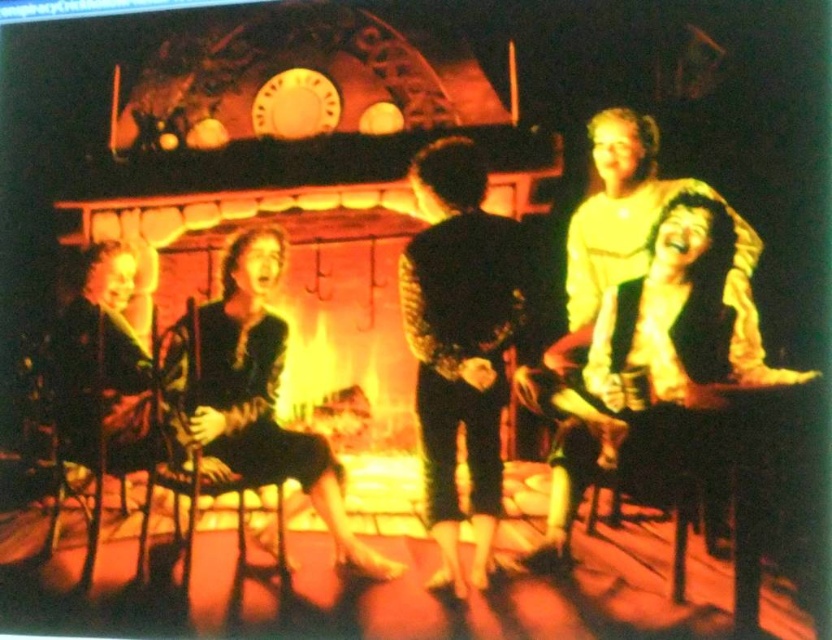
Based on the photo, does black textured jacket at center have a lesser height compared to matte black dress at center?

In fact, black textured jacket at center may be taller than matte black dress at center.

Is point (438, 141) farther from camera compared to point (176, 337)?

Yes, it is.

This screenshot has height=640, width=832. What are the coordinates of `black textured jacket at center` in the screenshot? It's located at (459, 342).

Which of these two, black textured jacket at center or wooden table at center, stands taller?

black textured jacket at center is taller.

Is black textured jacket at center positioned before wooden table at center?

No, black textured jacket at center is further to the viewer.

You are a GUI agent. You are given a task and a screenshot of the screen. Output one action in this format:
    pyautogui.click(x=<x>, y=<y>)
    Task: Click on the black textured jacket at center
    
    Given the screenshot: What is the action you would take?
    pyautogui.click(x=459, y=342)

This screenshot has height=640, width=832. Find the location of `black textured jacket at center`. black textured jacket at center is located at coordinates [x=459, y=342].

Can you confirm if matte black dress at center is shorter than wooden table at center?

Incorrect, matte black dress at center's height does not fall short of wooden table at center's.

Identify the location of matte black dress at center. This screenshot has width=832, height=640. (255, 394).

Describe the element at coordinates (255, 394) in the screenshot. This screenshot has height=640, width=832. I see `matte black dress at center` at that location.

This screenshot has height=640, width=832. In order to click on matte black dress at center in this screenshot , I will do `click(255, 394)`.